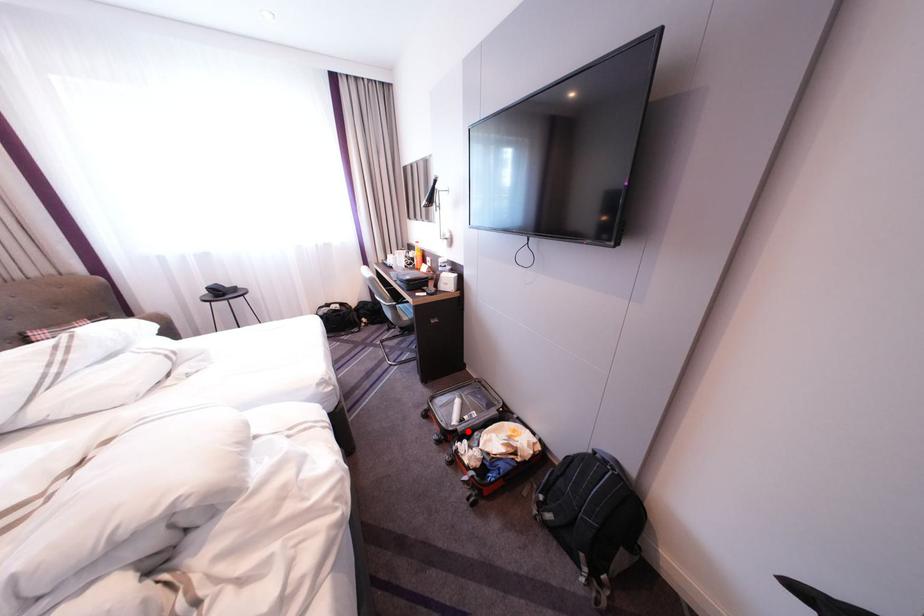
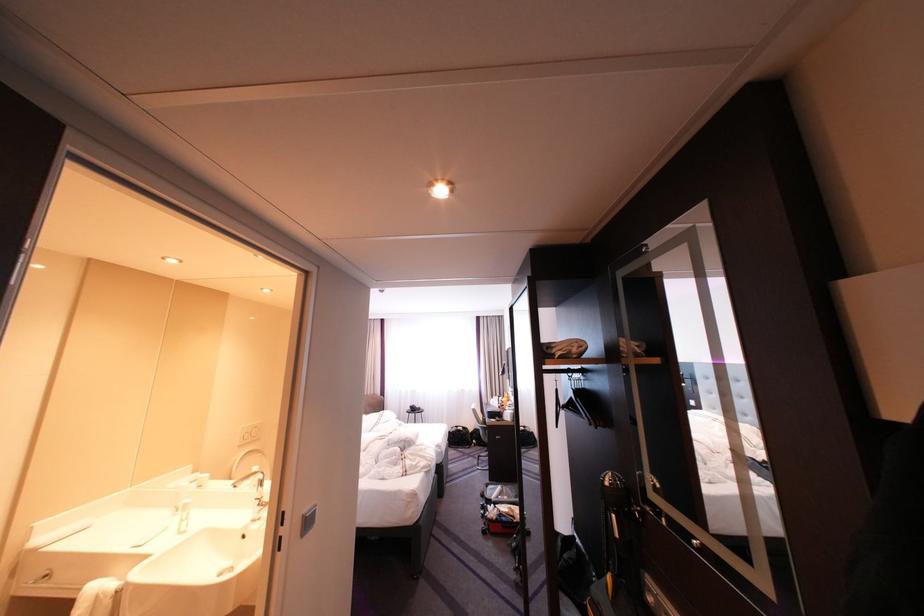
Where in the second image is the point corresponding to the highlighted location from the first image?

(503, 501)